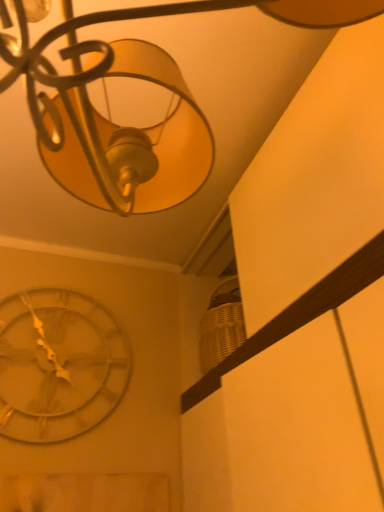
Question: From the image's perspective, does metallic silver clock at lower left appear lower than metallic gold lampshade at upper center?

Choices:
 (A) yes
 (B) no

Answer: (A)

Question: Is the position of metallic silver clock at lower left less distant than that of metallic gold lampshade at upper center?

Choices:
 (A) yes
 (B) no

Answer: (B)

Question: Is metallic silver clock at lower left far away from metallic gold lampshade at upper center?

Choices:
 (A) yes
 (B) no

Answer: (B)

Question: Is metallic gold lampshade at upper center surrounded by metallic silver clock at lower left?

Choices:
 (A) no
 (B) yes

Answer: (A)

Question: Could you tell me if metallic silver clock at lower left is turned towards metallic gold lampshade at upper center?

Choices:
 (A) no
 (B) yes

Answer: (B)

Question: Considering the relative positions of metallic silver clock at lower left and metallic gold lampshade at upper center in the image provided, is metallic silver clock at lower left to the right of metallic gold lampshade at upper center from the viewer's perspective?

Choices:
 (A) yes
 (B) no

Answer: (B)

Question: Considering the relative sizes of metallic gold lampshade at upper center and metallic silver clock at lower left in the image provided, is metallic gold lampshade at upper center smaller than metallic silver clock at lower left?

Choices:
 (A) yes
 (B) no

Answer: (B)

Question: Is metallic gold lampshade at upper center outside metallic silver clock at lower left?

Choices:
 (A) no
 (B) yes

Answer: (B)

Question: Is metallic gold lampshade at upper center facing towards metallic silver clock at lower left?

Choices:
 (A) no
 (B) yes

Answer: (A)

Question: Does metallic gold lampshade at upper center appear on the left side of metallic silver clock at lower left?

Choices:
 (A) no
 (B) yes

Answer: (A)

Question: Is metallic gold lampshade at upper center thinner than metallic silver clock at lower left?

Choices:
 (A) no
 (B) yes

Answer: (A)

Question: From a real-world perspective, is metallic gold lampshade at upper center physically above metallic silver clock at lower left?

Choices:
 (A) no
 (B) yes

Answer: (B)

Question: From a real-world perspective, is metallic gold lampshade at upper center above or below metallic silver clock at lower left?

Choices:
 (A) below
 (B) above

Answer: (B)